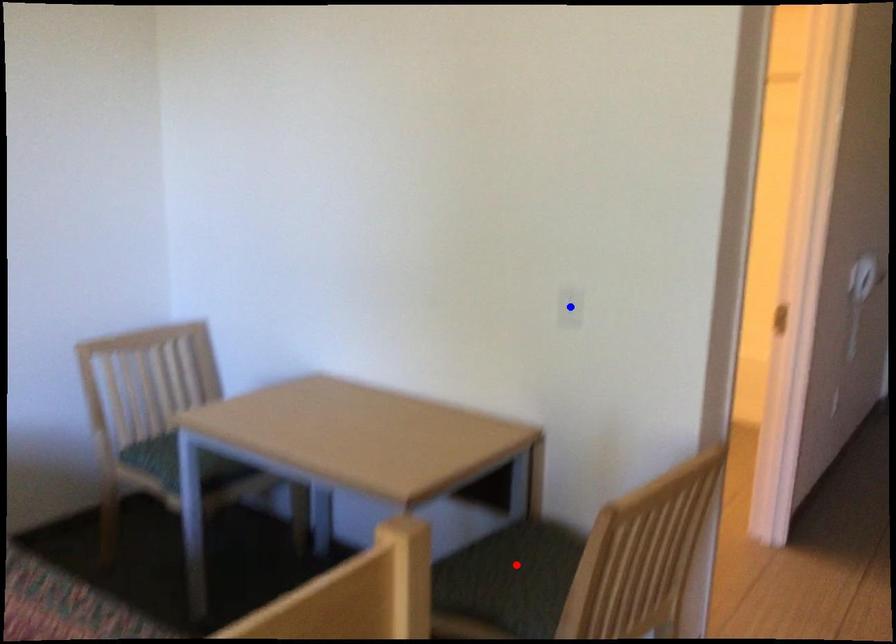
Question: In the image, two points are highlighted. Which point is nearer to the camera? Reply with the corresponding letter.

Choices:
 (A) blue point
 (B) red point

Answer: (B)